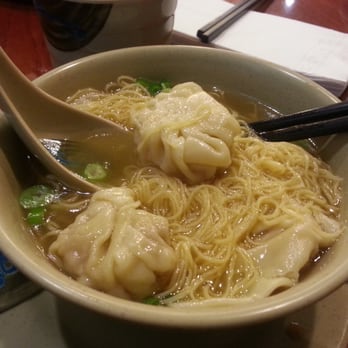
The image size is (348, 348). What are the coordinates of `spoon` in the screenshot? It's located at (43, 137).